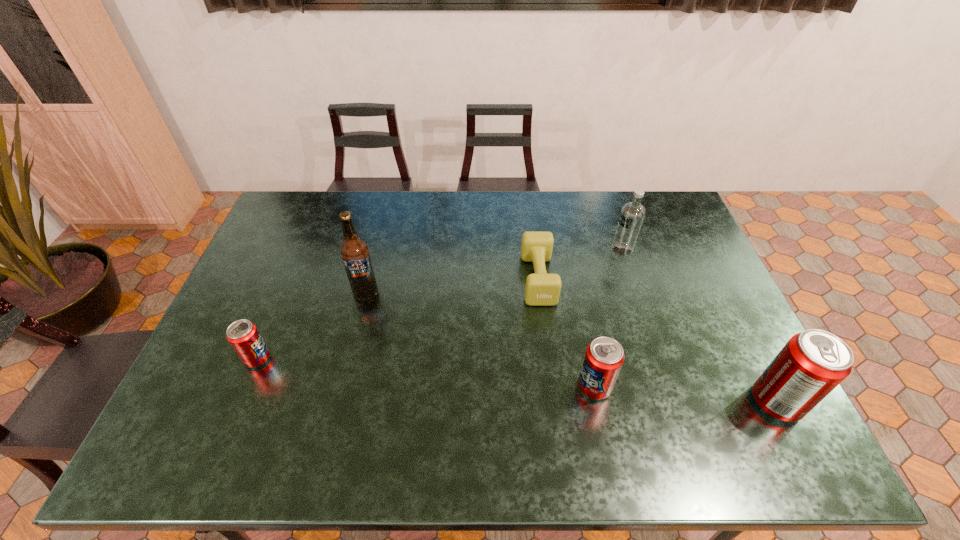
Locate an element on the screen. object at the right edge is located at coordinates (814, 362).

The image size is (960, 540). What are the coordinates of `object located at the near right corner` in the screenshot? It's located at (814, 362).

What are the coordinates of `vacant space at the far edge` in the screenshot? It's located at (540, 195).

In the image, there is a desktop. At what (x,y) coordinates should I click in order to perform the action: click on free space at the near edge. Please return your answer as a coordinate pair (x, y). The height and width of the screenshot is (540, 960). Looking at the image, I should click on (680, 417).

Identify the location of free space at the left edge. (271, 330).

Image resolution: width=960 pixels, height=540 pixels. Identify the location of blank area at the right edge. pyautogui.click(x=715, y=381).

Where is `free space at the far left corner`? The image size is (960, 540). free space at the far left corner is located at coordinates (299, 214).

You are a GUI agent. You are given a task and a screenshot of the screen. Output one action in this format:
    pyautogui.click(x=<x>, y=<y>)
    Task: Click on the free region at the near left corner of the desktop
    This screenshot has height=540, width=960.
    Given the screenshot: What is the action you would take?
    pyautogui.click(x=197, y=404)

In order to click on vacant point at the far right corner in this screenshot , I will do `click(680, 224)`.

Locate an element on the screen. This screenshot has width=960, height=540. free spot between the vodka and the second object from left to right is located at coordinates (493, 269).